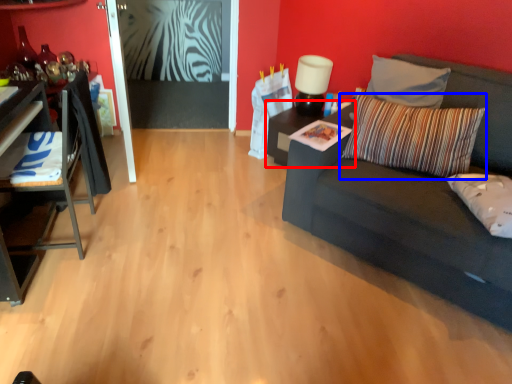
Question: Which object appears farthest to the camera in this image, table (highlighted by a red box) or pillow (highlighted by a blue box)?

Choices:
 (A) table
 (B) pillow

Answer: (A)